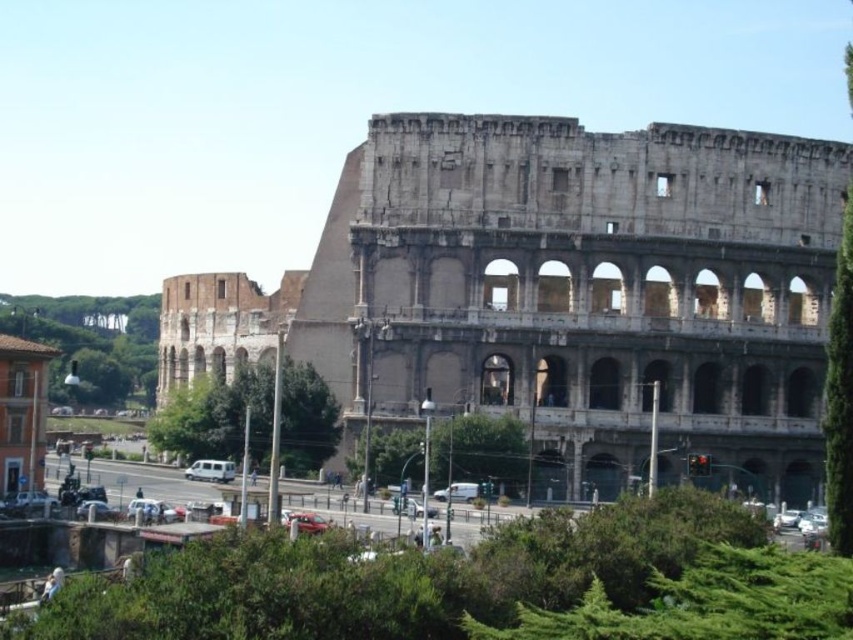
Question: Is gray stone amphitheater at center positioned before white matte van at center?

Choices:
 (A) yes
 (B) no

Answer: (A)

Question: Which object appears farthest from the camera in this image?

Choices:
 (A) white matte van at center
 (B) gray stone amphitheater at center

Answer: (A)

Question: Which of the following is the farthest from the observer?

Choices:
 (A) gray stone amphitheater at center
 (B) white matte van at center

Answer: (B)

Question: Is gray stone amphitheater at center positioned behind white matte van at center?

Choices:
 (A) no
 (B) yes

Answer: (A)

Question: Which point is farther to the camera?

Choices:
 (A) gray stone amphitheater at center
 (B) white matte van at center

Answer: (B)

Question: Is gray stone amphitheater at center wider than white matte van at center?

Choices:
 (A) no
 (B) yes

Answer: (B)